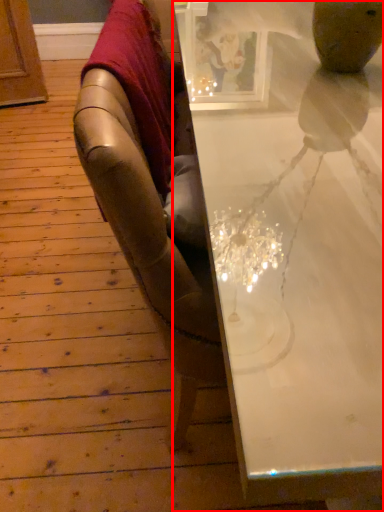
Question: From the image's perspective, what is the correct spatial relationship of table (annotated by the red box) in relation to blanket?

Choices:
 (A) above
 (B) below

Answer: (B)